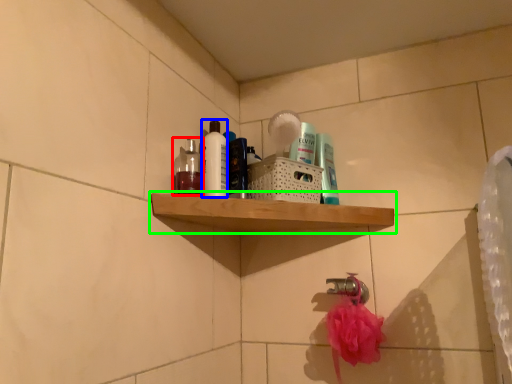
Question: Based on their relative distances, which object is farther from mouthwash (highlighted by a red box)? Choose from cleaning product (highlighted by a blue box) and shelf (highlighted by a green box).

Choices:
 (A) cleaning product
 (B) shelf

Answer: (B)